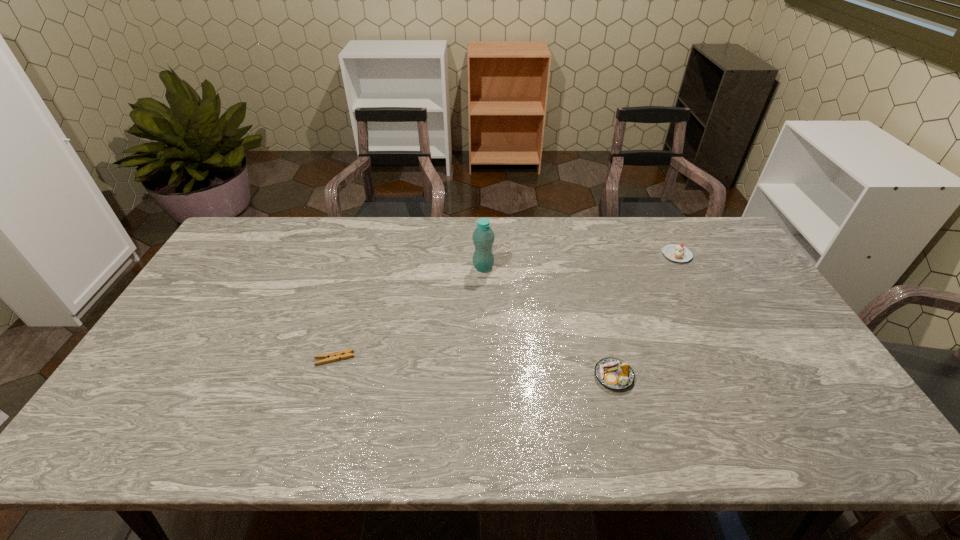
The height and width of the screenshot is (540, 960). I want to click on object located in the far edge section of the desktop, so click(x=675, y=252).

Locate an element on the screen. This screenshot has width=960, height=540. object at the right edge is located at coordinates (675, 252).

Locate an element on the screen. object situated at the far right corner is located at coordinates (675, 252).

Locate an element on the screen. free spot at the far edge of the desktop is located at coordinates (501, 240).

This screenshot has width=960, height=540. I want to click on free spot at the near edge of the desktop, so click(x=541, y=440).

This screenshot has width=960, height=540. In order to click on free space at the right edge in this screenshot , I will do `click(734, 287)`.

In the image, there is a desktop. What are the coordinates of `free space at the near left corner` in the screenshot? It's located at (151, 450).

Identify the location of free location at the far right corner. The height and width of the screenshot is (540, 960). [724, 233].

Find the location of a particular element. The height and width of the screenshot is (540, 960). empty location between the cupcake and the water bottle is located at coordinates (580, 261).

Locate an element on the screen. The image size is (960, 540). vacant area between the pastry and the rightmost object is located at coordinates click(645, 315).